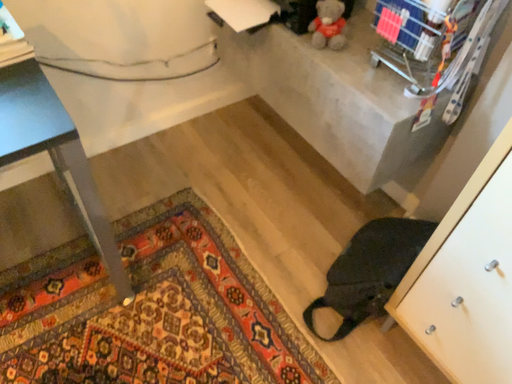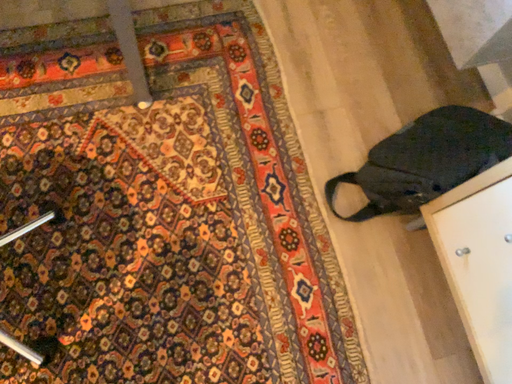
Question: Which way did the camera rotate in the video?

Choices:
 (A) rotated downward
 (B) rotated upward

Answer: (A)